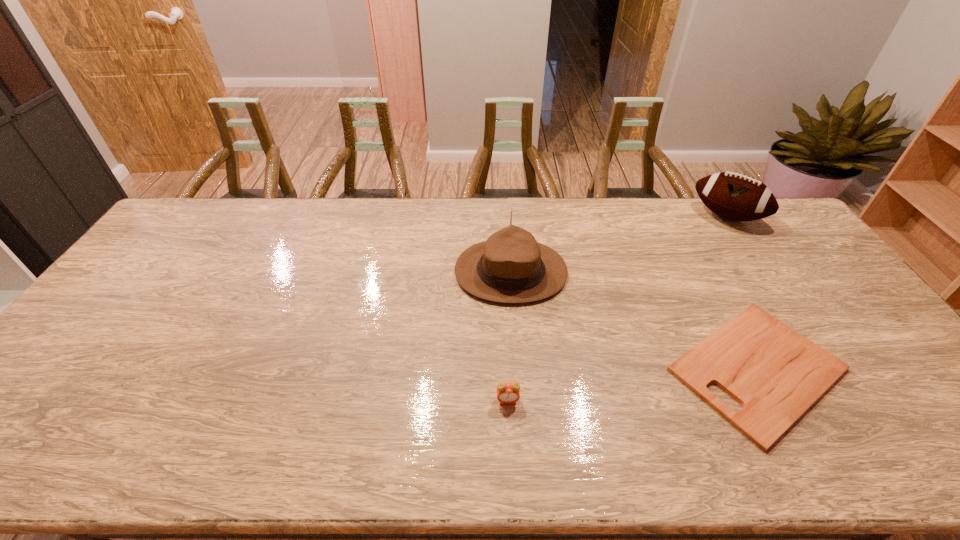
The width and height of the screenshot is (960, 540). What are the coordinates of `free space between the third nearest object and the alarm clock` in the screenshot? It's located at (509, 336).

This screenshot has height=540, width=960. What are the coordinates of `free space between the chopping board and the farthest object` in the screenshot? It's located at (742, 293).

This screenshot has height=540, width=960. In order to click on free space between the chopping board and the fedora in this screenshot , I will do `click(634, 320)`.

Where is `unoccupied position between the farthest object and the shortest object`? This screenshot has width=960, height=540. unoccupied position between the farthest object and the shortest object is located at coordinates (742, 293).

This screenshot has height=540, width=960. What are the coordinates of `vacant region between the farthest object and the chopping board` in the screenshot? It's located at (742, 293).

Locate an element on the screen. The width and height of the screenshot is (960, 540). unoccupied area between the shortest object and the farthest object is located at coordinates (742, 293).

Image resolution: width=960 pixels, height=540 pixels. What are the coordinates of `vacant space that's between the shortest object and the fedora` in the screenshot? It's located at coord(634,320).

Where is `free point between the football (American) and the chopping board`? The width and height of the screenshot is (960, 540). free point between the football (American) and the chopping board is located at coordinates (742, 293).

Locate an element on the screen. The height and width of the screenshot is (540, 960). free space between the second farthest object and the chopping board is located at coordinates (634, 320).

In order to click on vacant space in between the fedora and the football (American) in this screenshot , I will do click(x=618, y=244).